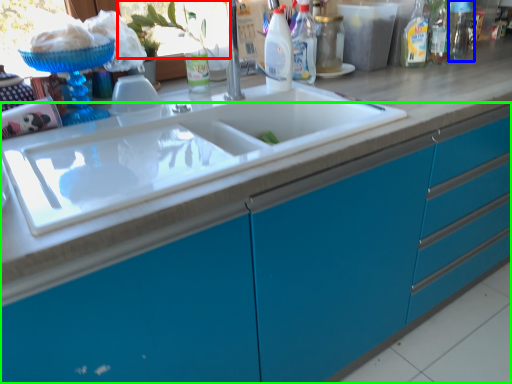
Question: Estimate the real-world distances between objects in this image. Which object is closer to window screen (highlighted by a red box), bottle (highlighted by a blue box) or cabinetry (highlighted by a green box)?

Choices:
 (A) bottle
 (B) cabinetry

Answer: (B)